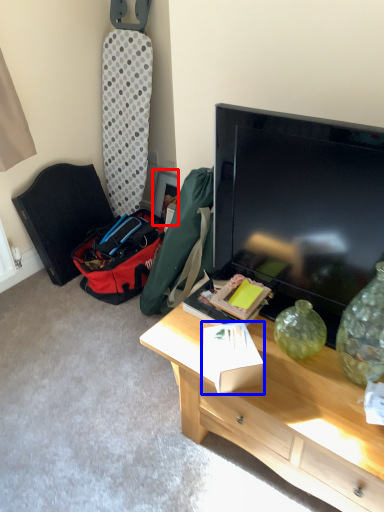
Question: Among these objects, which one is farthest to the camera, picture frame (highlighted by a red box) or box (highlighted by a blue box)?

Choices:
 (A) picture frame
 (B) box

Answer: (A)